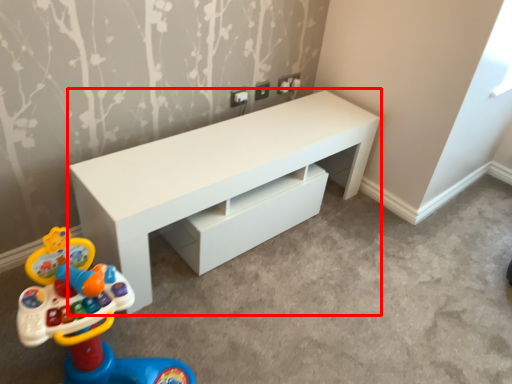
Question: Where is table (annotated by the red box) located in relation to toy in the image?

Choices:
 (A) right
 (B) left

Answer: (A)